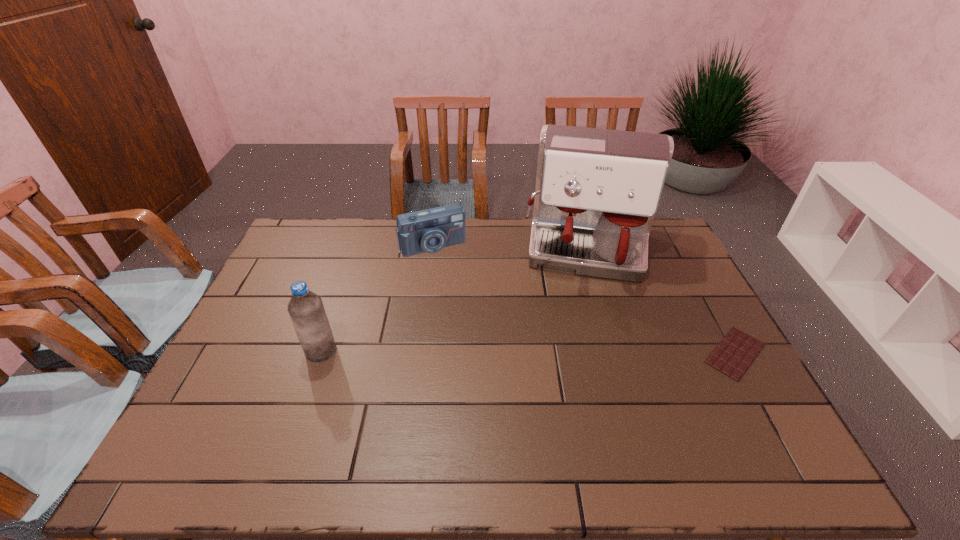
The image size is (960, 540). I want to click on free space between the tallest object and the camera, so click(511, 249).

Where is `unoccupied area between the second object from left to right and the water bottle`? This screenshot has height=540, width=960. unoccupied area between the second object from left to right and the water bottle is located at coordinates (377, 298).

In order to click on free area in between the leftmost object and the third object from right to left in this screenshot , I will do [377, 298].

Find the location of `free point between the water bottle and the tallest object`. free point between the water bottle and the tallest object is located at coordinates (454, 302).

Where is `vacant region between the third object from right to left and the shortest object`? vacant region between the third object from right to left and the shortest object is located at coordinates (584, 299).

What are the coordinates of `object that stands as the closest to the second tallest object` in the screenshot? It's located at (430, 230).

Identify which object is located as the third nearest to the shortest object. Please provide its 2D coordinates. Your answer should be formatted as a tuple, i.e. [(x, y)], where the tuple contains the x and y coordinates of a point satisfying the conditions above.

[(306, 310)]

Image resolution: width=960 pixels, height=540 pixels. Identify the location of free spot that satisfies the following two spatial constraints: 1. on the back side of the leftmost object; 2. on the right side of the second object from left to right. (357, 246).

This screenshot has width=960, height=540. Find the location of `vacant space that satisfies the following two spatial constraints: 1. on the back side of the third shortest object; 2. on the left side of the tallest object`. vacant space that satisfies the following two spatial constraints: 1. on the back side of the third shortest object; 2. on the left side of the tallest object is located at coordinates (355, 252).

Identify the location of free region that satisfies the following two spatial constraints: 1. on the back side of the water bottle; 2. on the right side of the coffee maker. (355, 252).